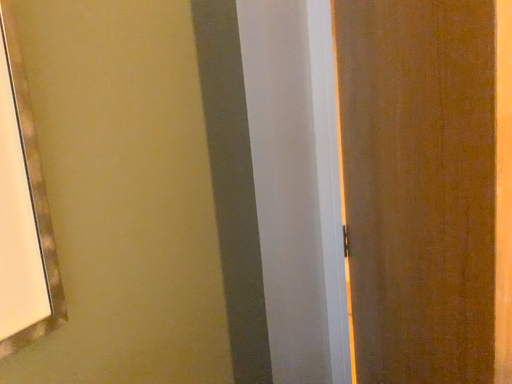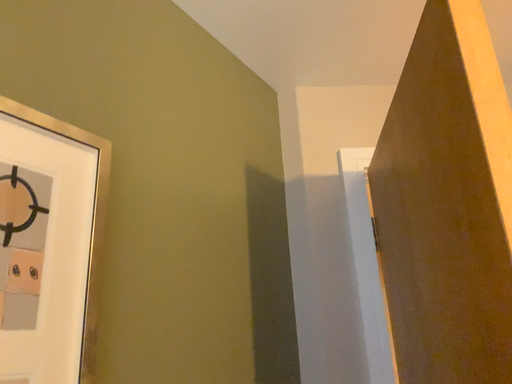
Question: How did the camera likely rotate when shooting the video?

Choices:
 (A) rotated right
 (B) rotated left

Answer: (B)